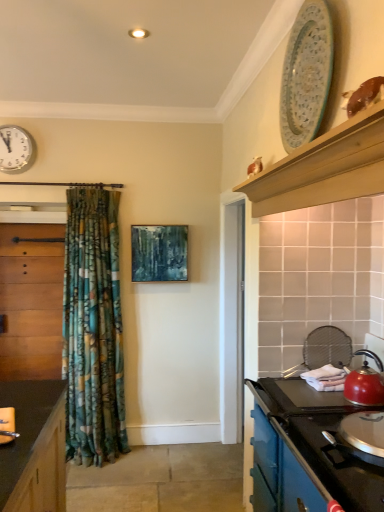
Question: Considering the relative positions of porcelain plate at upper right and blue enamel stove at lower right, the 2th cabinetry when ordered from left to right, in the image provided, is porcelain plate at upper right to the right of blue enamel stove at lower right, the 2th cabinetry when ordered from left to right, from the viewer's perspective?

Choices:
 (A) no
 (B) yes

Answer: (A)

Question: From a real-world perspective, is porcelain plate at upper right on blue enamel stove at lower right, placed as the second cabinetry when sorted from back to front?

Choices:
 (A) yes
 (B) no

Answer: (A)

Question: Does porcelain plate at upper right have a lesser width compared to blue enamel stove at lower right, the first cabinetry from the right?

Choices:
 (A) no
 (B) yes

Answer: (B)

Question: From the image's perspective, is porcelain plate at upper right on blue enamel stove at lower right, the first cabinetry from the right?

Choices:
 (A) yes
 (B) no

Answer: (A)

Question: Is porcelain plate at upper right oriented towards blue enamel stove at lower right, the first cabinetry from the right?

Choices:
 (A) yes
 (B) no

Answer: (B)

Question: Is wooden cabinet at left, acting as the 2th cabinetry starting from the front, spatially inside matte black sink at lower left, or outside of it?

Choices:
 (A) outside
 (B) inside

Answer: (A)

Question: Is point (52, 344) positioned closer to the camera than point (1, 436)?

Choices:
 (A) farther
 (B) closer

Answer: (A)

Question: Relative to matte black sink at lower left, is wooden cabinet at left, which is the first cabinetry in left-to-right order, in front or behind?

Choices:
 (A) behind
 (B) front

Answer: (A)

Question: In the image, is wooden cabinet at left, which is the first cabinetry in left-to-right order, on the left side or the right side of matte black sink at lower left?

Choices:
 (A) left
 (B) right

Answer: (A)

Question: From their relative heights in the image, would you say teal matte painting at center is taller or shorter than white glossy clock at upper left?

Choices:
 (A) tall
 (B) short

Answer: (A)

Question: Considering the positions of teal matte painting at center and white glossy clock at upper left in the image, is teal matte painting at center bigger or smaller than white glossy clock at upper left?

Choices:
 (A) small
 (B) big

Answer: (B)

Question: In the image, is teal matte painting at center positioned in front of or behind white glossy clock at upper left?

Choices:
 (A) front
 (B) behind

Answer: (B)

Question: Considering the positions of teal matte painting at center and white glossy clock at upper left in the image, is teal matte painting at center wider or thinner than white glossy clock at upper left?

Choices:
 (A) wide
 (B) thin

Answer: (A)

Question: Is point (18, 157) positioned closer to the camera than point (168, 225)?

Choices:
 (A) farther
 (B) closer

Answer: (B)

Question: Considering their positions, is white glossy clock at upper left located in front of or behind teal matte painting at center?

Choices:
 (A) behind
 (B) front

Answer: (B)